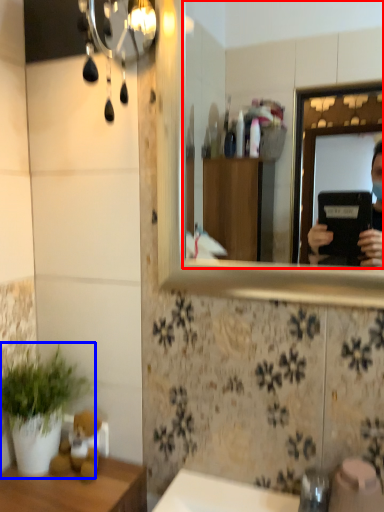
Question: Which object appears closest to the camera in this image, mirror (highlighted by a red box) or houseplant (highlighted by a blue box)?

Choices:
 (A) mirror
 (B) houseplant

Answer: (A)